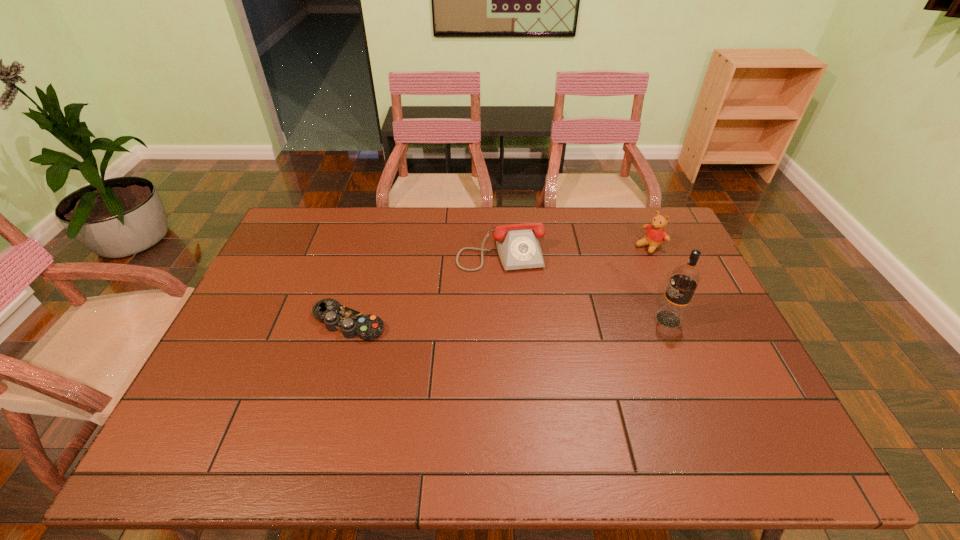
Image resolution: width=960 pixels, height=540 pixels. Find the location of `object positioned at the far right corner`. object positioned at the far right corner is located at coordinates (655, 235).

The height and width of the screenshot is (540, 960). In the image, there is a desktop. Identify the location of vacant space at the far edge. (560, 217).

You are a GUI agent. You are given a task and a screenshot of the screen. Output one action in this format:
    pyautogui.click(x=<x>, y=<y>)
    Task: Click on the vacant space at the left edge of the desktop
    This screenshot has height=540, width=960.
    Given the screenshot: What is the action you would take?
    pyautogui.click(x=233, y=333)

Locate an element on the screen. The image size is (960, 540). free region at the right edge of the desktop is located at coordinates (679, 264).

The image size is (960, 540). I want to click on vacant region at the near left corner of the desktop, so click(x=199, y=399).

Image resolution: width=960 pixels, height=540 pixels. I want to click on free spot at the far right corner of the desktop, so click(x=637, y=238).

I want to click on vacant region between the telephone and the shortest object, so [424, 285].

The image size is (960, 540). I want to click on vacant area that lies between the leftmost object and the vodka, so click(509, 321).

You are a GUI agent. You are given a task and a screenshot of the screen. Output one action in this format:
    pyautogui.click(x=<x>, y=<y>)
    Task: Click on the empty space that is in between the shortest object and the teddy bear
    Image resolution: width=960 pixels, height=540 pixels.
    Given the screenshot: What is the action you would take?
    pyautogui.click(x=499, y=284)

You are a GUI agent. You are given a task and a screenshot of the screen. Output one action in this format:
    pyautogui.click(x=<x>, y=<y>)
    Task: Click on the vacant area that lies between the shortest object and the vodka
    
    Given the screenshot: What is the action you would take?
    pyautogui.click(x=509, y=321)